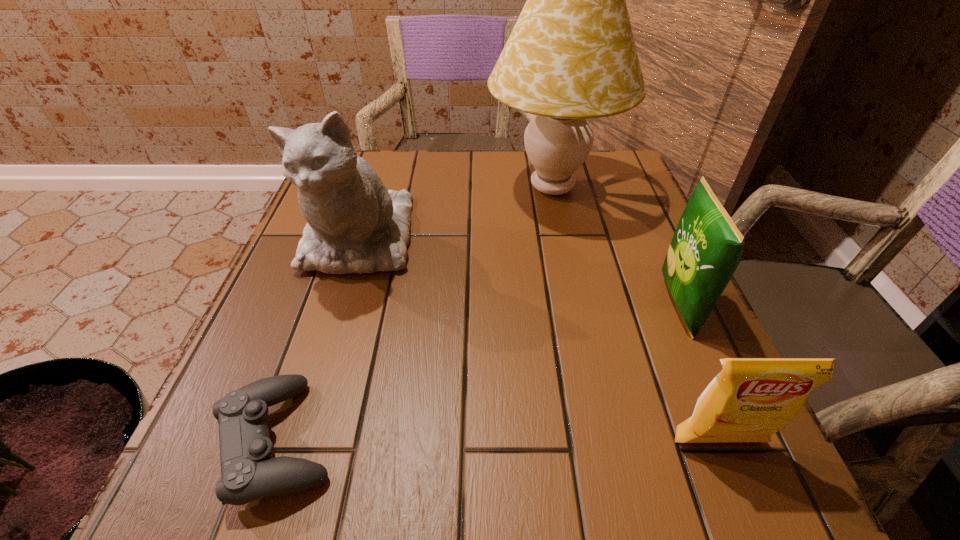
Find the location of a particular element. Image resolution: width=960 pixels, height=540 pixels. empty space between the control and the farther crisp (potato chip) is located at coordinates (478, 373).

Locate an element on the screen. The image size is (960, 540). vacant area that lies between the farther crisp (potato chip) and the lampshade is located at coordinates (615, 247).

The width and height of the screenshot is (960, 540). Identify the location of vacant area between the control and the fourth shortest object. (319, 340).

You are a GUI agent. You are given a task and a screenshot of the screen. Output one action in this format:
    pyautogui.click(x=<x>, y=<y>)
    Task: Click on the free space between the nearer crisp (potato chip) and the lampshade
    This screenshot has width=960, height=540.
    Given the screenshot: What is the action you would take?
    pyautogui.click(x=635, y=315)

Identify the location of vacant space that is in between the control and the tallest object. (415, 314).

Identify the location of empty location between the tallest object and the nearer crisp (potato chip). (635, 315).

Where is `free space between the farther crisp (potato chip) and the nearer crisp (potato chip)`? This screenshot has width=960, height=540. free space between the farther crisp (potato chip) and the nearer crisp (potato chip) is located at coordinates (698, 374).

The image size is (960, 540). What are the coordinates of `vacant area that lies between the nearer crisp (potato chip) and the farther crisp (potato chip)` in the screenshot? It's located at (698, 374).

At what (x,y) coordinates should I click in order to perform the action: click on vacant area that lies between the farther crisp (potato chip) and the nearer crisp (potato chip). Please return your answer as a coordinate pair (x, y). The width and height of the screenshot is (960, 540). Looking at the image, I should click on (698, 374).

Select which object appears as the closest to the farther crisp (potato chip). Please provide its 2D coordinates. Your answer should be formatted as a tuple, i.e. [(x, y)], where the tuple contains the x and y coordinates of a point satisfying the conditions above.

[(571, 56)]